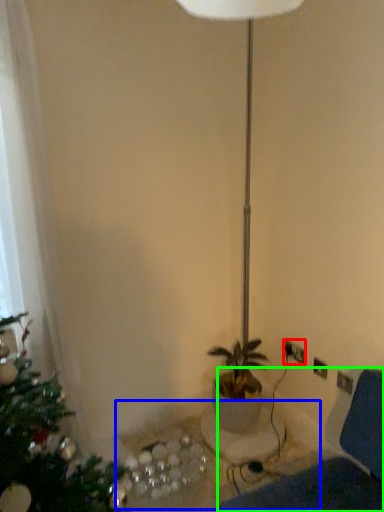
Question: Considering the real-world distances, which object is closest to electric outlet (highlighted by a red box)? table (highlighted by a blue box) or swivel chair (highlighted by a green box).

Choices:
 (A) table
 (B) swivel chair

Answer: (A)